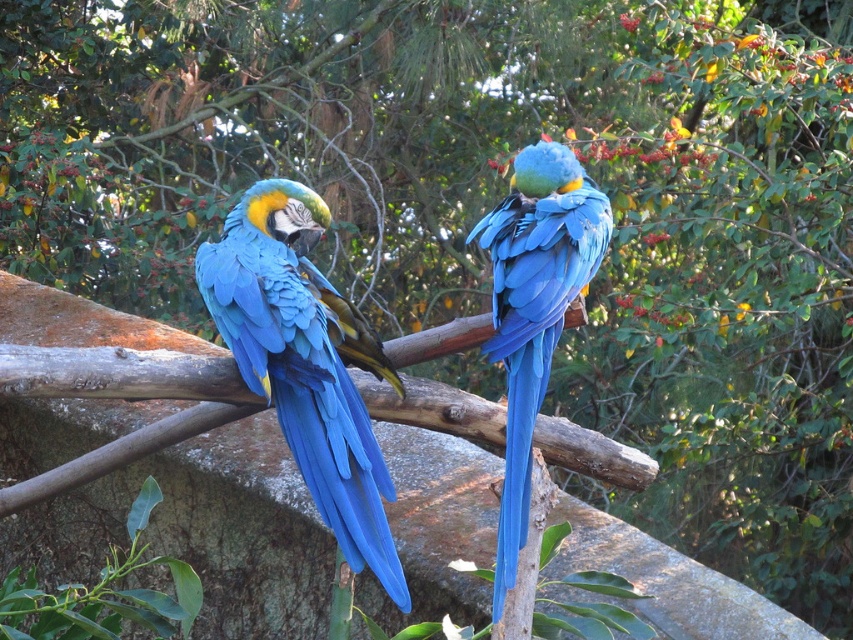
Question: Does blue glossy parrot at left appear over blue glossy parrot at center?

Choices:
 (A) yes
 (B) no

Answer: (B)

Question: Which point is farther to the camera?

Choices:
 (A) (238, 209)
 (B) (514, 408)

Answer: (A)

Question: Which point is closer to the camera?

Choices:
 (A) [x=527, y=396]
 (B) [x=258, y=282]

Answer: (A)

Question: Is blue glossy parrot at left wider than blue glossy parrot at center?

Choices:
 (A) yes
 (B) no

Answer: (A)

Question: Observing the image, what is the correct spatial positioning of blue glossy parrot at left in reference to blue glossy parrot at center?

Choices:
 (A) above
 (B) below

Answer: (B)